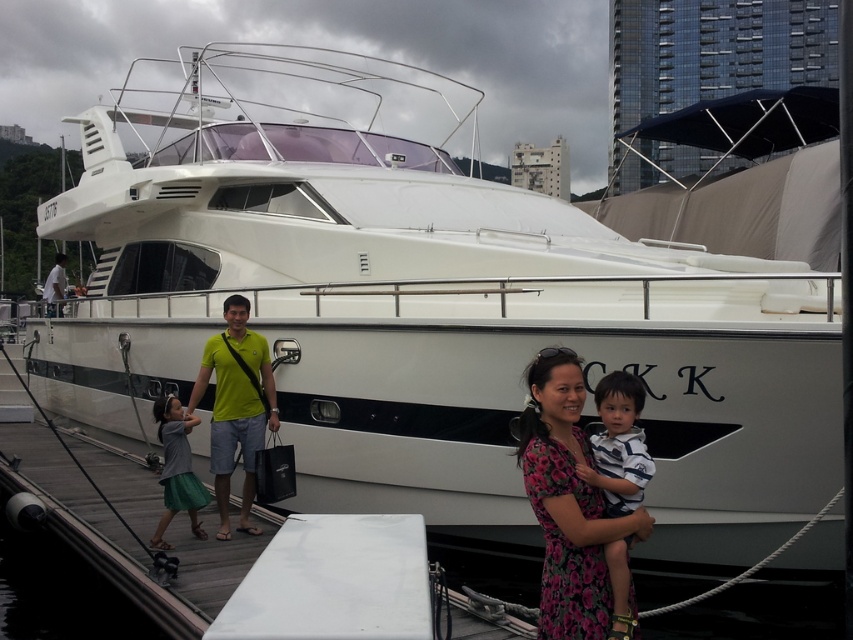
Question: Which point appears closest to the camera in this image?

Choices:
 (A) (598, 452)
 (B) (228, 460)

Answer: (A)

Question: Which point is closer to the camera?

Choices:
 (A) click(x=593, y=560)
 (B) click(x=192, y=472)
 (C) click(x=51, y=292)

Answer: (A)

Question: Is yellow fabric shirt at center further to camera compared to matte gray dress at lower left?

Choices:
 (A) no
 (B) yes

Answer: (B)

Question: Which of the following is the farthest from the observer?

Choices:
 (A) floral fabric dress at center
 (B) striped cotton shirt at center

Answer: (B)

Question: Does floral fabric dress at center appear on the right side of yellow fabric shirt at center?

Choices:
 (A) yes
 (B) no

Answer: (A)

Question: Observing the image, what is the correct spatial positioning of floral fabric dress at center in reference to matte gray dress at lower left?

Choices:
 (A) right
 (B) left

Answer: (A)